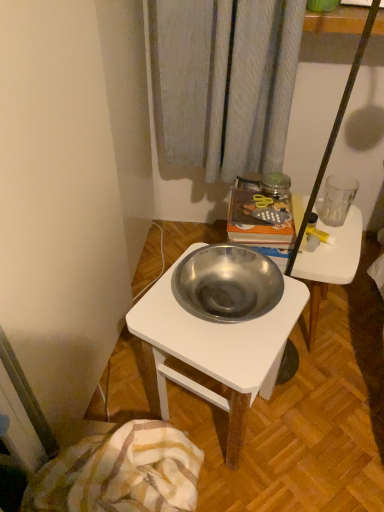
You are a GUI agent. You are given a task and a screenshot of the screen. Output one action in this format:
    pyautogui.click(x=<x>, y=<y>)
    Task: Click on the vacant area in front of metallic silver bowl at center
    
    Given the screenshot: What is the action you would take?
    pyautogui.click(x=330, y=396)